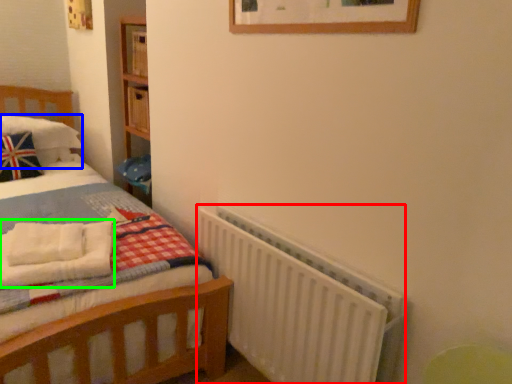
Question: Which object is the closest to the radiator (highlighted by a red box)? Choose among these: pillow (highlighted by a blue box) or blanket (highlighted by a green box).

Choices:
 (A) pillow
 (B) blanket

Answer: (B)